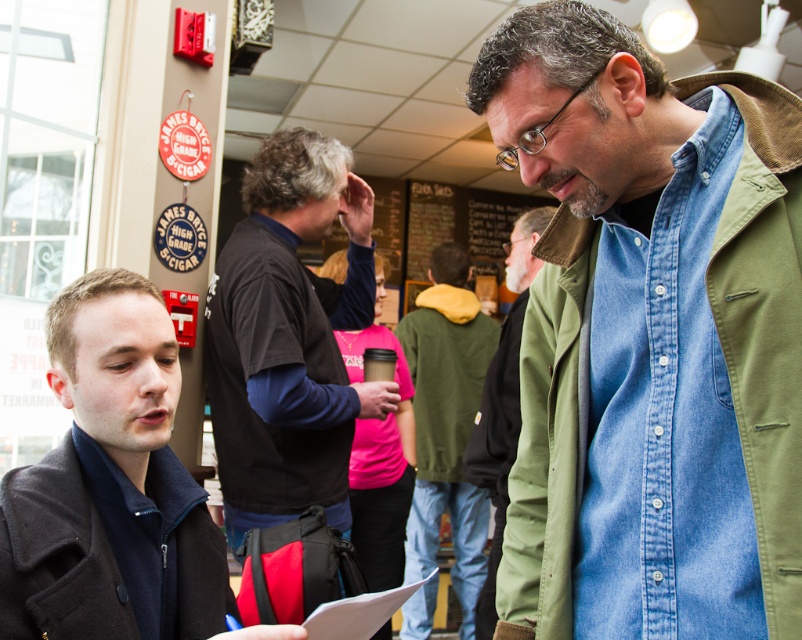
Question: Among these objects, which one is nearest to the camera?

Choices:
 (A) green matte jacket at center
 (B) dark gray wool coat at lower left
 (C) green carhartt jacket at center

Answer: (B)

Question: From the image, what is the correct spatial relationship of green carhartt jacket at center in relation to green matte jacket at center?

Choices:
 (A) below
 (B) above

Answer: (B)

Question: In this image, where is dark gray wool coat at lower left located relative to black softshell jacket at center?

Choices:
 (A) below
 (B) above

Answer: (A)

Question: Which point is closer to the camera?

Choices:
 (A) (29, 576)
 (B) (492, 387)

Answer: (A)

Question: Is black softshell jacket at center positioned in front of green carhartt jacket at center?

Choices:
 (A) no
 (B) yes

Answer: (B)

Question: Which point is farther to the camera?

Choices:
 (A) denim shirt at center
 (B) dark green fleece jacket at center

Answer: (B)